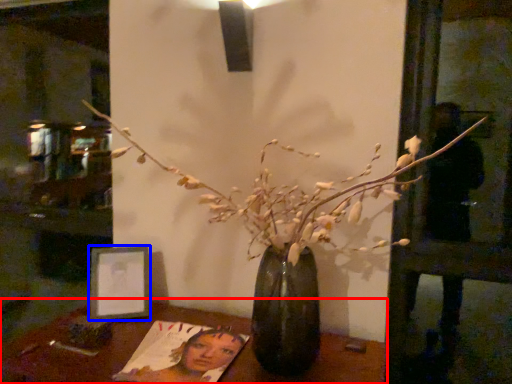
Question: Which of the following is the farthest to the observer, table (highlighted by a red box) or picture frame (highlighted by a blue box)?

Choices:
 (A) table
 (B) picture frame

Answer: (B)